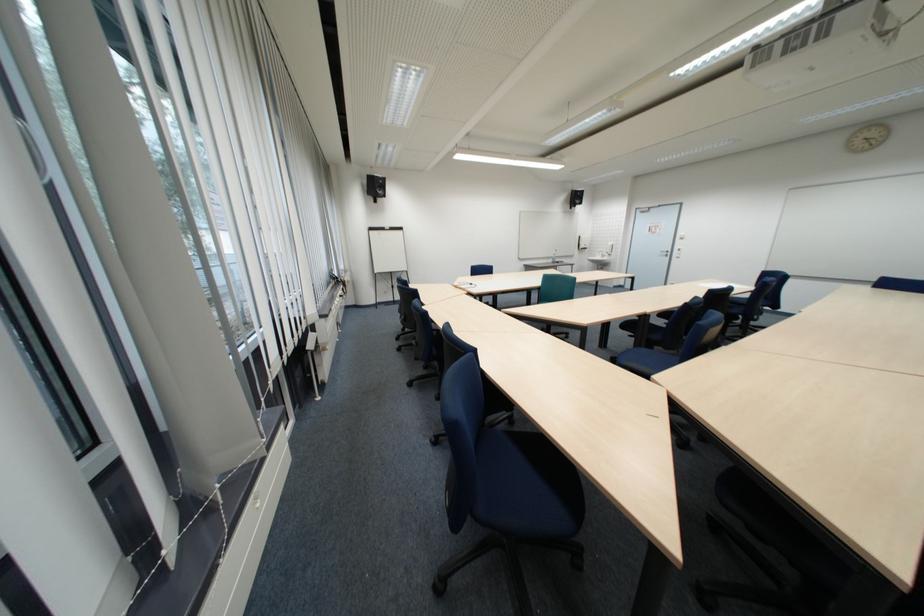
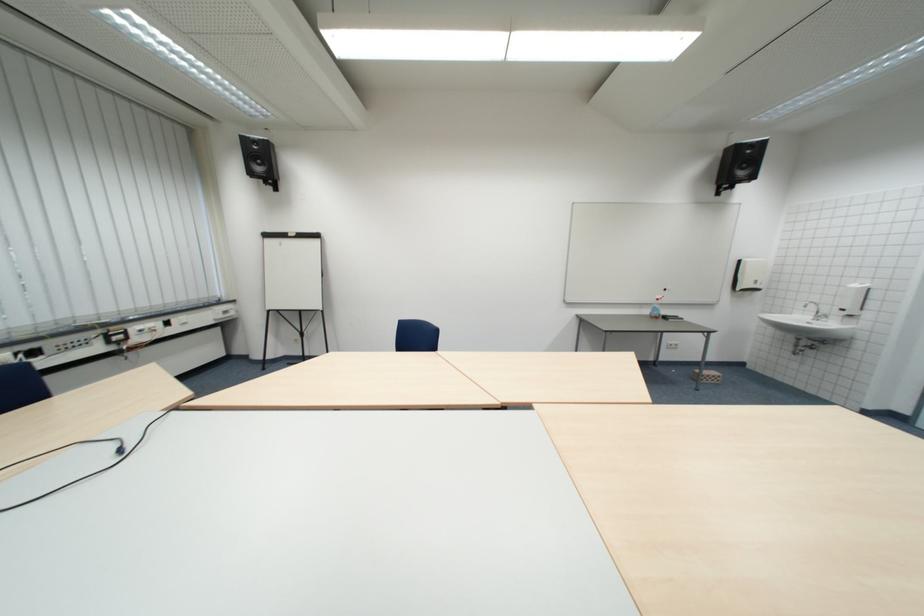
The images are taken continuously from a first-person perspective. In which direction are you moving?

The movement direction of the cameraman is right, forward.